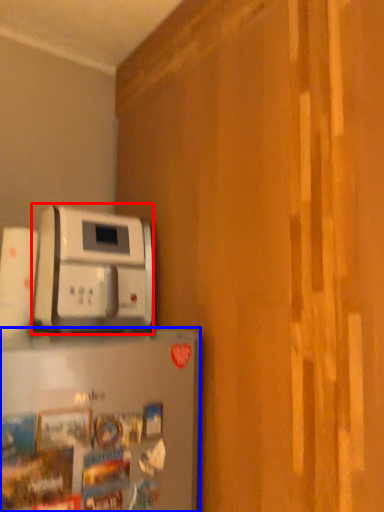
Question: Which point is further to the camera, home appliance (highlighted by a red box) or home appliance (highlighted by a blue box)?

Choices:
 (A) home appliance
 (B) home appliance

Answer: (A)